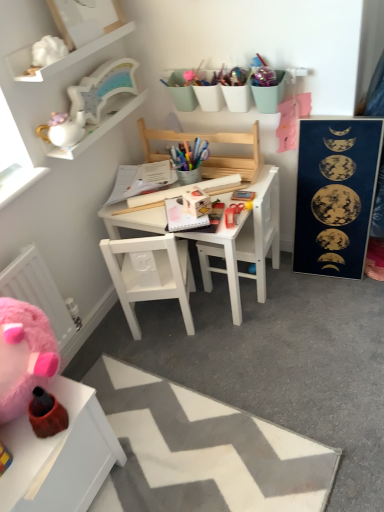
Question: Does white zigzag rug at lower center contain white glossy mug at upper left?

Choices:
 (A) yes
 (B) no

Answer: (B)

Question: Is white zigzag rug at lower center at the right side of white glossy mug at upper left?

Choices:
 (A) no
 (B) yes

Answer: (B)

Question: Can you confirm if white zigzag rug at lower center is thinner than white glossy mug at upper left?

Choices:
 (A) yes
 (B) no

Answer: (B)

Question: Considering the relative positions of white zigzag rug at lower center and white glossy mug at upper left in the image provided, is white zigzag rug at lower center behind white glossy mug at upper left?

Choices:
 (A) no
 (B) yes

Answer: (A)

Question: From the image's perspective, does white zigzag rug at lower center appear lower than white glossy mug at upper left?

Choices:
 (A) no
 (B) yes

Answer: (B)

Question: Can you confirm if white zigzag rug at lower center is shorter than white glossy mug at upper left?

Choices:
 (A) no
 (B) yes

Answer: (A)

Question: Considering the relative sizes of blue matte poster at right and white glossy mug at upper left in the image provided, is blue matte poster at right wider than white glossy mug at upper left?

Choices:
 (A) no
 (B) yes

Answer: (B)

Question: Is blue matte poster at right not close to white glossy mug at upper left?

Choices:
 (A) yes
 (B) no

Answer: (B)

Question: Is blue matte poster at right turned away from white glossy mug at upper left?

Choices:
 (A) yes
 (B) no

Answer: (B)

Question: Is blue matte poster at right not inside white glossy mug at upper left?

Choices:
 (A) yes
 (B) no

Answer: (A)

Question: From the image's perspective, is blue matte poster at right below white glossy mug at upper left?

Choices:
 (A) yes
 (B) no

Answer: (A)

Question: Does blue matte poster at right appear on the right side of white glossy mug at upper left?

Choices:
 (A) yes
 (B) no

Answer: (A)

Question: From a real-world perspective, is white ceramic teapot at upper left, the second toy when ordered from top to bottom, located beneath white zigzag rug at lower center?

Choices:
 (A) yes
 (B) no

Answer: (B)